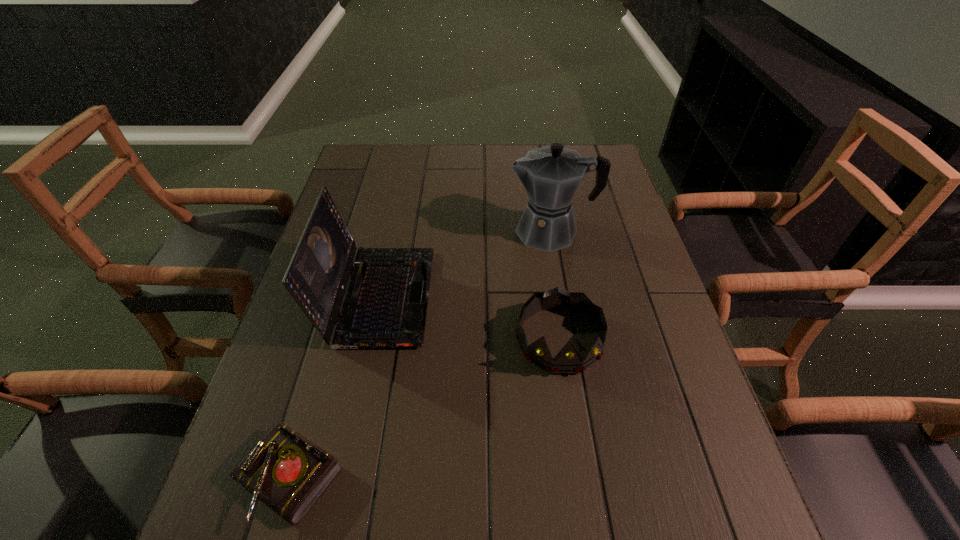
Locate which object is the closest to the tallest object. Please provide its 2D coordinates. Your answer should be formatted as a tuple, i.e. [(x, y)], where the tuple contains the x and y coordinates of a point satisfying the conditions above.

[(569, 359)]

Point out which object is positioned as the third nearest to the laptop computer. Please provide its 2D coordinates. Your answer should be formatted as a tuple, i.e. [(x, y)], where the tuple contains the x and y coordinates of a point satisfying the conditions above.

[(569, 359)]

Where is `free space that satisfies the following two spatial constraints: 1. at the spout of the farthest object; 2. at the front of the tiara with jewels`? The height and width of the screenshot is (540, 960). free space that satisfies the following two spatial constraints: 1. at the spout of the farthest object; 2. at the front of the tiara with jewels is located at coordinates (569, 340).